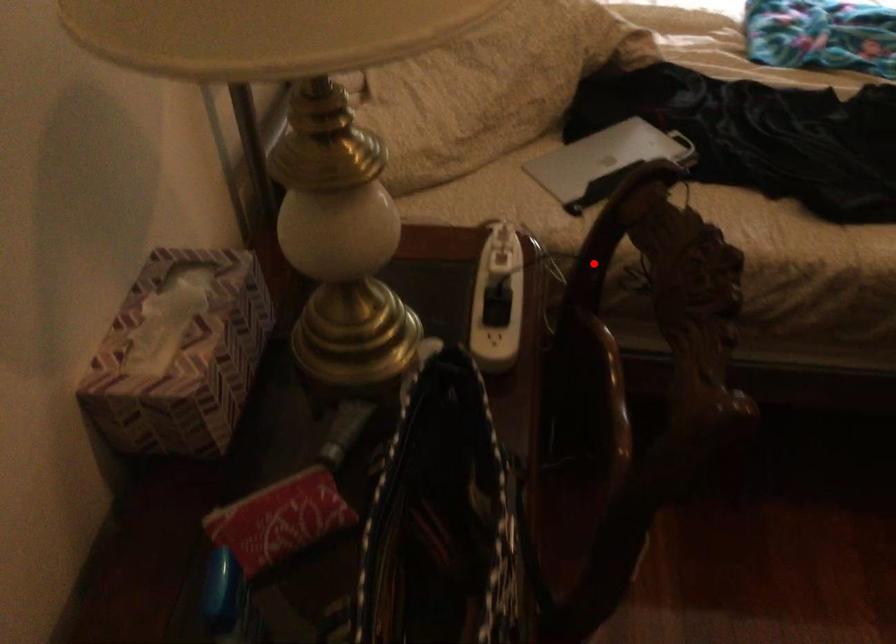
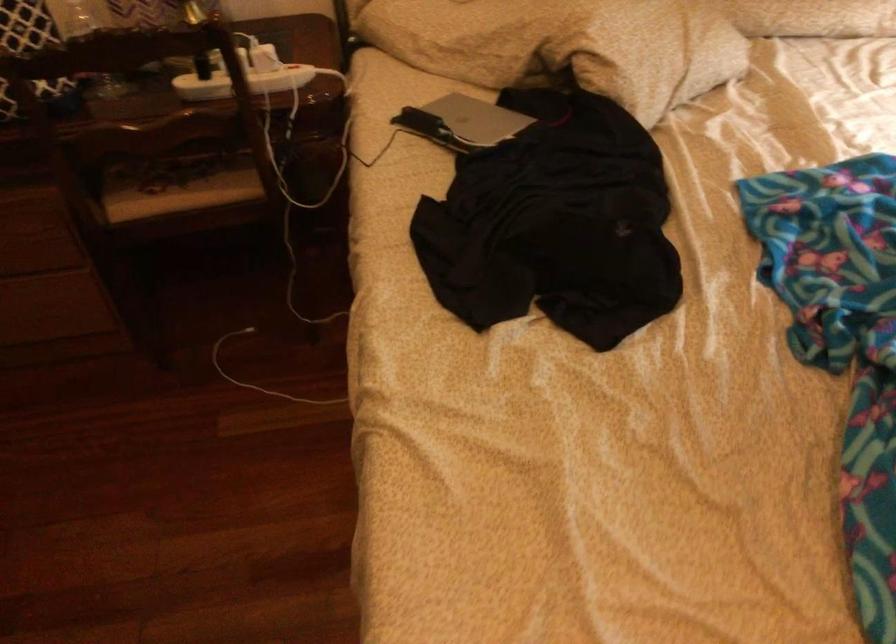
Question: I am providing you with two images of the same scene from different viewpoints. Given a red point in image1, look at the same physical point in image2. Is it:

Choices:
 (A) Closer to the viewpoint
 (B) Farther from the viewpoint

Answer: (B)